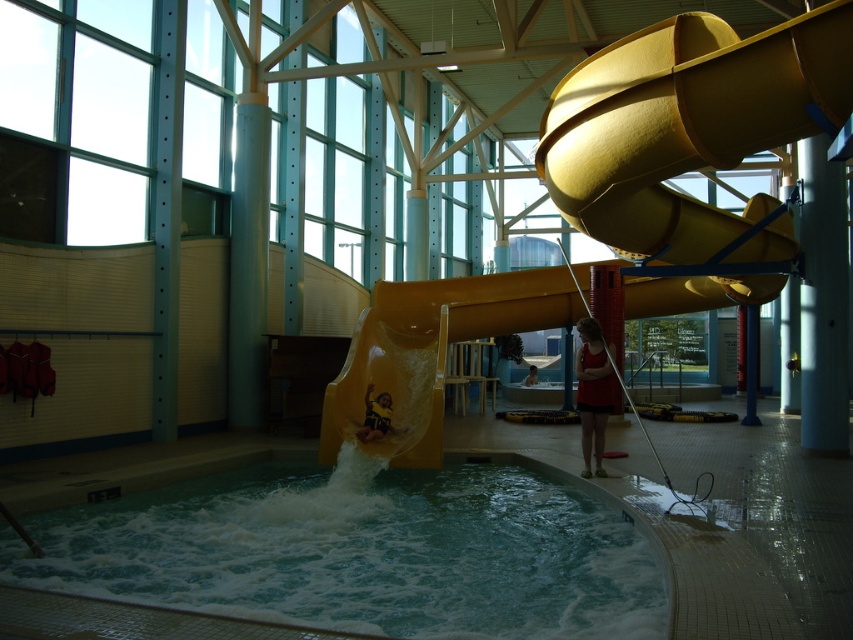
The width and height of the screenshot is (853, 640). What are the coordinates of `yellow rubber slide at center` in the screenshot? It's located at (688, 124).

Who is higher up, yellow rubber slide at center or yellow matte slide at center?

yellow rubber slide at center is above.

Who is more forward, (534,296) or (399,433)?

Point (399,433) is more forward.

Where is `yellow rubber slide at center`? Image resolution: width=853 pixels, height=640 pixels. yellow rubber slide at center is located at coordinates 688,124.

Does point (585, 380) come behind point (384, 412)?

No, (585, 380) is closer to viewer.

Is red matte shorts at lower center to the left of dark blue fabric at center from the viewer's perspective?

Incorrect, red matte shorts at lower center is not on the left side of dark blue fabric at center.

Image resolution: width=853 pixels, height=640 pixels. In order to click on red matte shorts at lower center in this screenshot , I will do `click(593, 392)`.

Can you confirm if yellow rubber slide at center is taller than dark blue fabric at center?

Indeed, yellow rubber slide at center has a greater height compared to dark blue fabric at center.

Can you confirm if yellow rubber slide at center is positioned to the left of dark blue fabric at center?

No, yellow rubber slide at center is not to the left of dark blue fabric at center.

Who is more distant from viewer, (380, 314) or (380, 401)?

Point (380, 314)

Where is `yellow rubber slide at center`? Image resolution: width=853 pixels, height=640 pixels. yellow rubber slide at center is located at coordinates (688, 124).